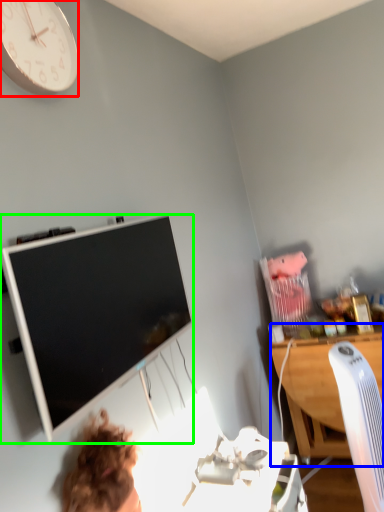
Question: Based on their relative distances, which object is nearer to wall clock (highlighted by a red box)? Choose from desk (highlighted by a blue box) and television (highlighted by a green box).

Choices:
 (A) desk
 (B) television

Answer: (B)